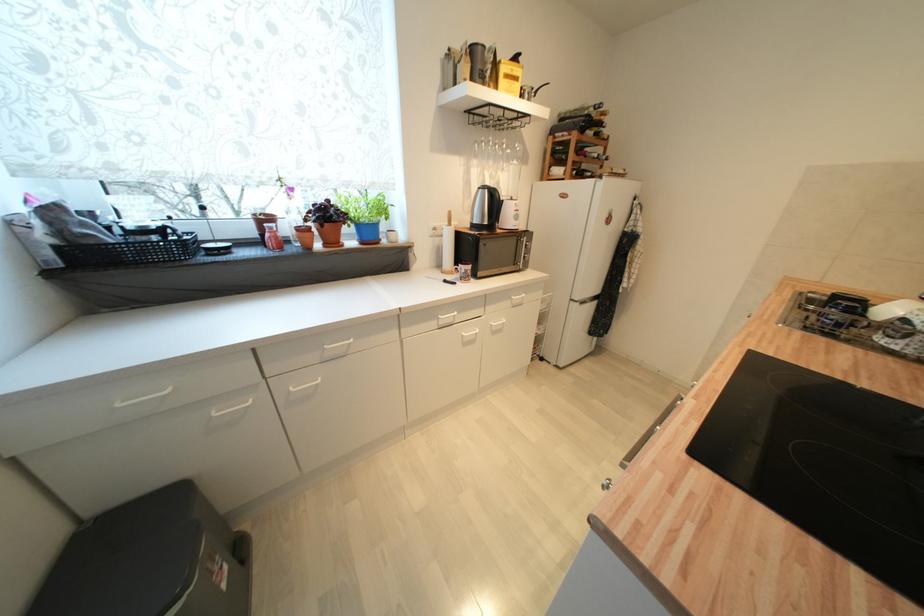
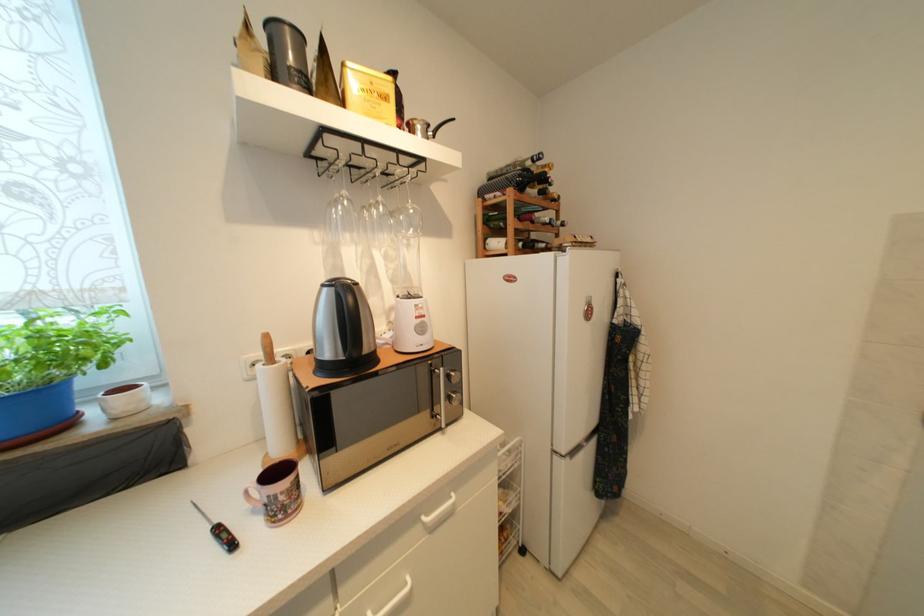
Where in the second image is the point corresponding to (x=521, y=81) from the first image?

(391, 100)